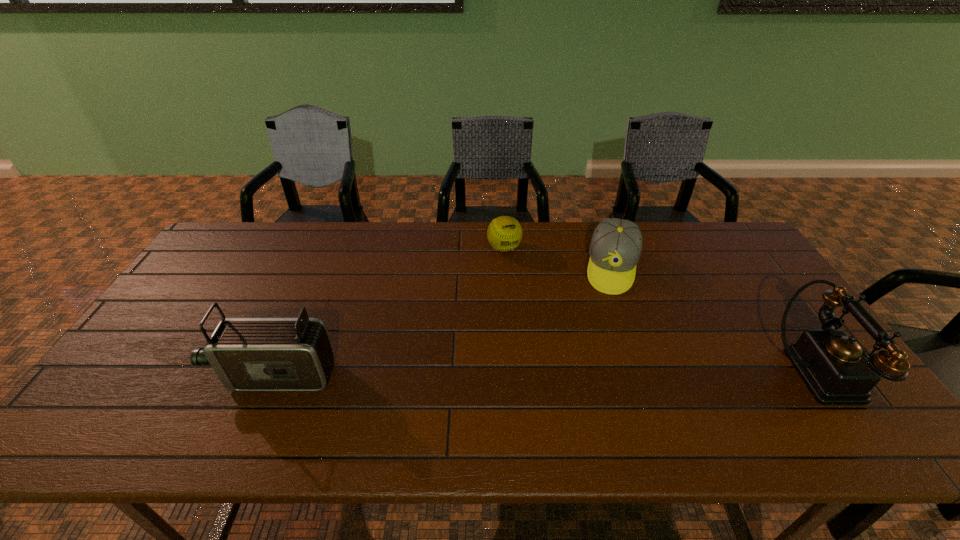
Where is `unoccupied position between the camcorder and the rightmost object`? This screenshot has width=960, height=540. unoccupied position between the camcorder and the rightmost object is located at coordinates (545, 374).

This screenshot has width=960, height=540. Find the location of `unoccupied area between the shortest object and the leftmost object`. unoccupied area between the shortest object and the leftmost object is located at coordinates [390, 312].

The width and height of the screenshot is (960, 540). I want to click on vacant space that is in between the softball and the telephone, so pos(660,310).

This screenshot has width=960, height=540. Find the location of `vacant point located between the telephone and the baseball cap`. vacant point located between the telephone and the baseball cap is located at coordinates (713, 320).

Identify which object is the second closest to the leftmost object. Please provide its 2D coordinates. Your answer should be formatted as a tuple, i.e. [(x, y)], where the tuple contains the x and y coordinates of a point satisfying the conditions above.

[(616, 244)]

I want to click on the third closest object relative to the second object from left to right, so click(838, 370).

Where is `vacant area in the image that satisfies the following two spatial constraints: 1. on the front side of the telephone; 2. on the front of the softball at the rotary dial`? This screenshot has width=960, height=540. vacant area in the image that satisfies the following two spatial constraints: 1. on the front side of the telephone; 2. on the front of the softball at the rotary dial is located at coordinates (513, 373).